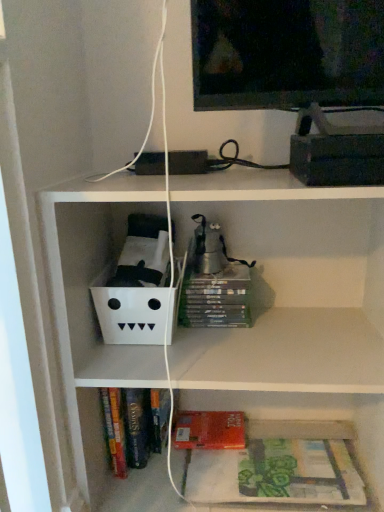
Question: From the image's perspective, would you say hardcover books at lower center is shown under red matte paperback book at lower center?

Choices:
 (A) no
 (B) yes

Answer: (B)

Question: Could you tell me if hardcover books at lower center is facing red matte paperback book at lower center?

Choices:
 (A) no
 (B) yes

Answer: (A)

Question: Does hardcover books at lower center have a larger size compared to red matte paperback book at lower center?

Choices:
 (A) yes
 (B) no

Answer: (A)

Question: Does hardcover books at lower center contain red matte paperback book at lower center?

Choices:
 (A) no
 (B) yes

Answer: (A)

Question: Is hardcover books at lower center not inside red matte paperback book at lower center?

Choices:
 (A) yes
 (B) no

Answer: (A)

Question: Considering the relative sizes of hardcover books at lower center and red matte paperback book at lower center in the image provided, is hardcover books at lower center smaller than red matte paperback book at lower center?

Choices:
 (A) no
 (B) yes

Answer: (A)

Question: Can you confirm if red matte paperback book at lower center is thinner than hardcover books at lower center?

Choices:
 (A) yes
 (B) no

Answer: (A)

Question: Is the position of red matte paperback book at lower center more distant than that of hardcover books at lower center?

Choices:
 (A) no
 (B) yes

Answer: (B)

Question: Can you confirm if red matte paperback book at lower center is taller than hardcover books at lower center?

Choices:
 (A) yes
 (B) no

Answer: (B)

Question: From the image's perspective, would you say red matte paperback book at lower center is positioned over hardcover books at lower center?

Choices:
 (A) yes
 (B) no

Answer: (A)

Question: Can you confirm if red matte paperback book at lower center is shorter than hardcover books at lower center?

Choices:
 (A) yes
 (B) no

Answer: (A)

Question: Does red matte paperback book at lower center appear on the left side of hardcover books at lower center?

Choices:
 (A) no
 (B) yes

Answer: (B)

Question: Considering the relative sizes of green matte book at lower right and hardcover books at lower center in the image provided, is green matte book at lower right smaller than hardcover books at lower center?

Choices:
 (A) yes
 (B) no

Answer: (A)